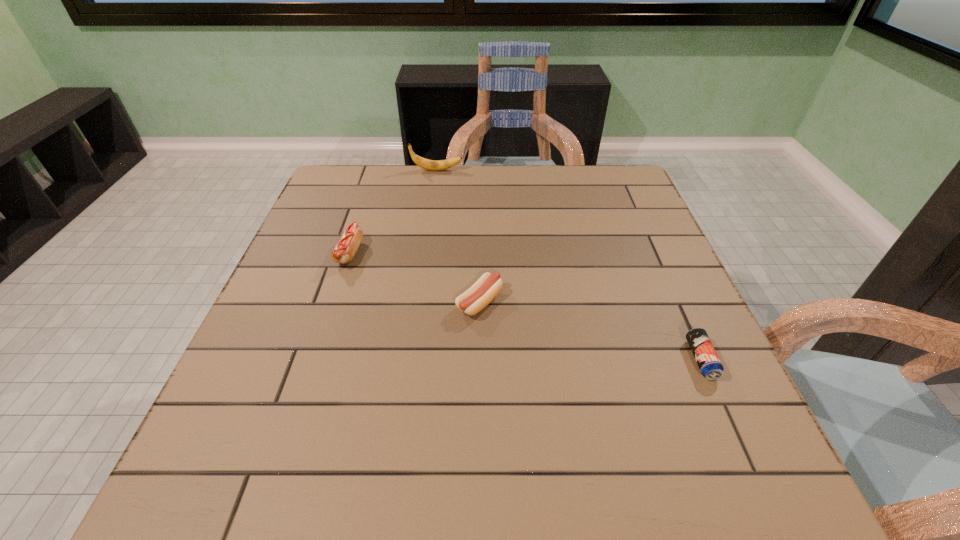
The width and height of the screenshot is (960, 540). In the image, there is a desktop. Find the location of `vacant space at the near left corner`. vacant space at the near left corner is located at coordinates (215, 466).

Identify the location of free space between the beer can and the nearer sausage. The height and width of the screenshot is (540, 960). (590, 331).

This screenshot has width=960, height=540. Find the location of `free space between the second object from left to right and the third object from left to right`. free space between the second object from left to right and the third object from left to right is located at coordinates (458, 236).

This screenshot has height=540, width=960. Identify the location of vacant space that's between the nearer sausage and the nearest object. 590,331.

I want to click on free area in between the shorter sausage and the third shortest object, so [x=415, y=278].

Identify the location of empty space between the banana and the rightmost object. (568, 265).

Locate an element on the screen. free spot between the rightmost object and the farthest object is located at coordinates (568, 265).

You are a GUI agent. You are given a task and a screenshot of the screen. Output one action in this format:
    pyautogui.click(x=<x>, y=<y>)
    Task: Click on the free space between the right sausage and the third shortest object
    
    Given the screenshot: What is the action you would take?
    pyautogui.click(x=415, y=278)

Image resolution: width=960 pixels, height=540 pixels. I want to click on free area in between the third shortest object and the shorter sausage, so click(x=415, y=278).

Locate an element on the screen. The height and width of the screenshot is (540, 960). free space between the third farthest object and the nearest object is located at coordinates (590, 331).